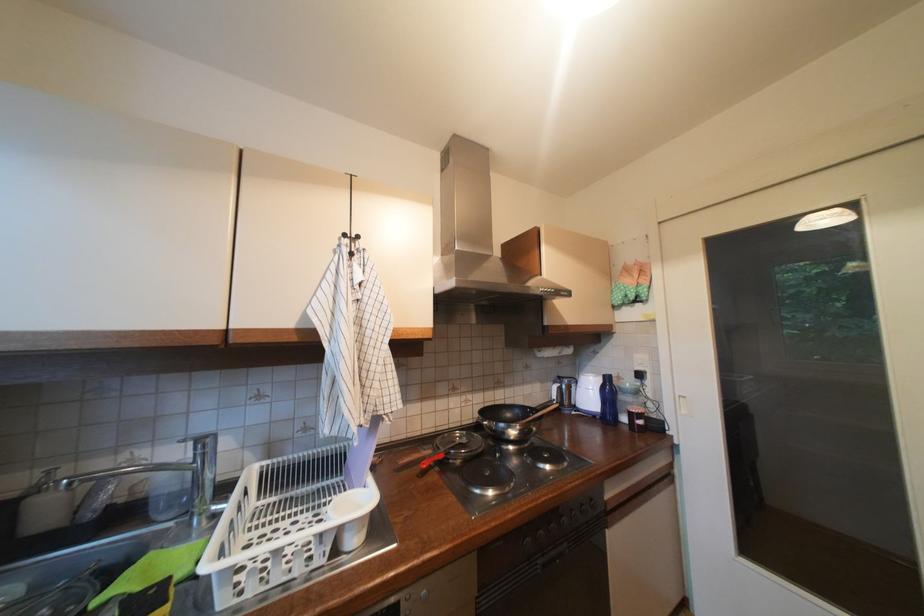
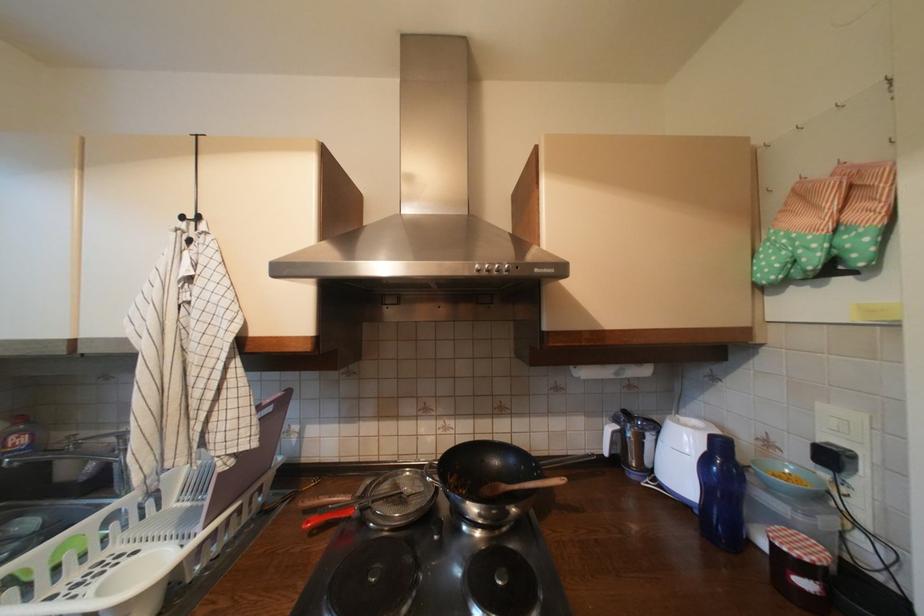
In the second image, find the point that corresponds to the point at 630,294 in the first image.

(793, 254)